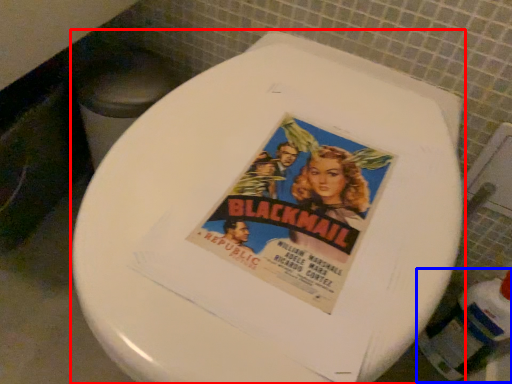
Question: Which object is further to the camera taking this photo, toilet (highlighted by a red box) or bottle (highlighted by a blue box)?

Choices:
 (A) toilet
 (B) bottle

Answer: (B)